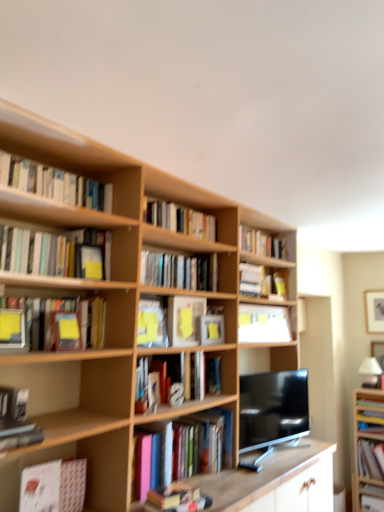
The height and width of the screenshot is (512, 384). Identify the location of free space above wooden bookshelf at upper center, which appears as the 11th book when ordered from the bottom (from a real-world perspective). (x=263, y=228).